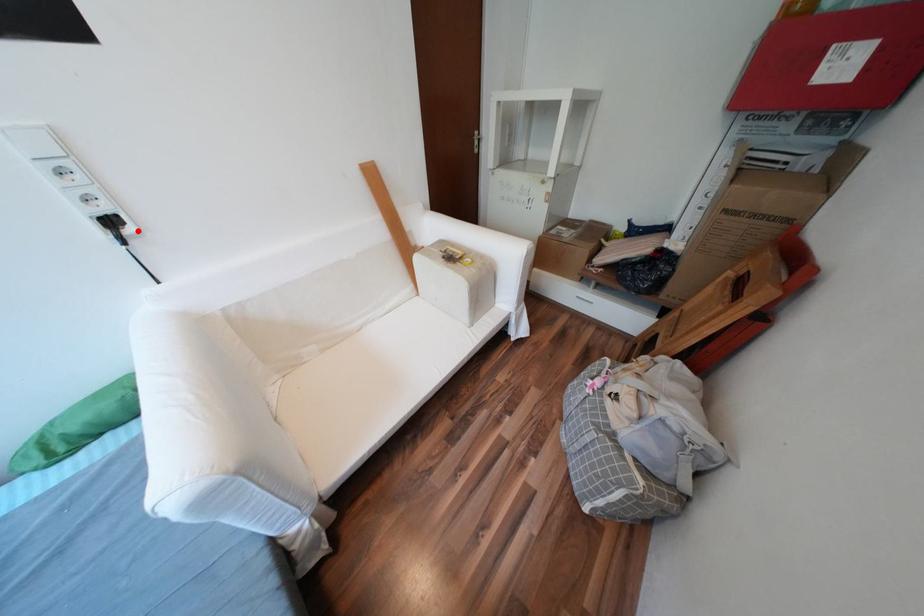
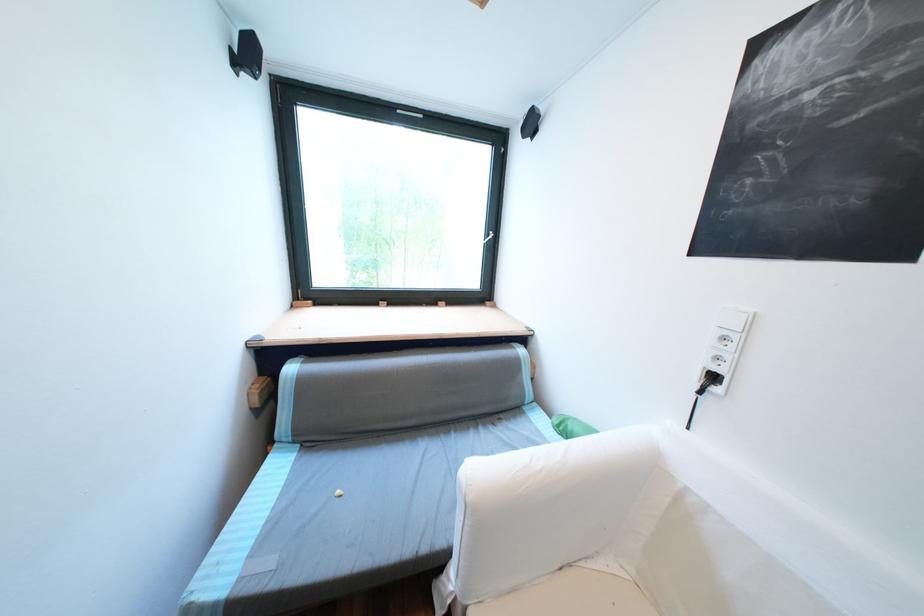
Locate, in the second image, the point that corresponds to the highlighted location in the first image.

(725, 390)